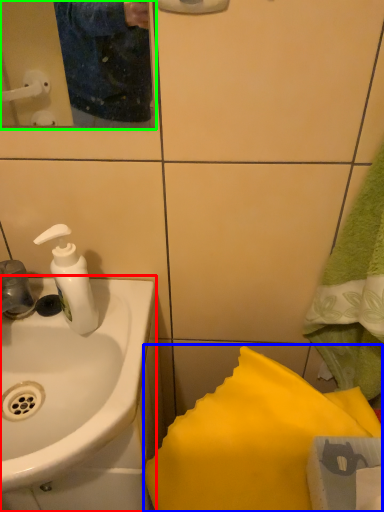
Question: Estimate the real-world distances between objects in this image. Which object is farther from sink (highlighted by a red box), bath towel (highlighted by a blue box) or mirror (highlighted by a green box)?

Choices:
 (A) bath towel
 (B) mirror

Answer: (B)